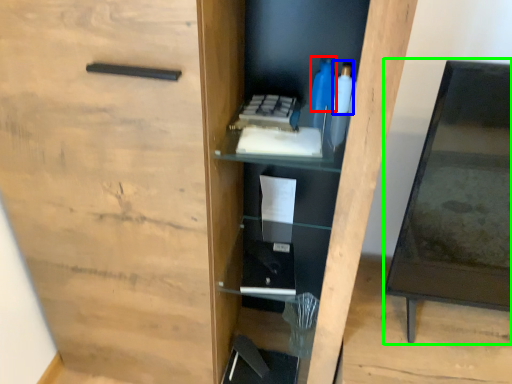
Question: Which object is positioned closest to bottle (highlighted by a red box)? Select from bottle (highlighted by a blue box) and table (highlighted by a green box).

Choices:
 (A) bottle
 (B) table

Answer: (A)